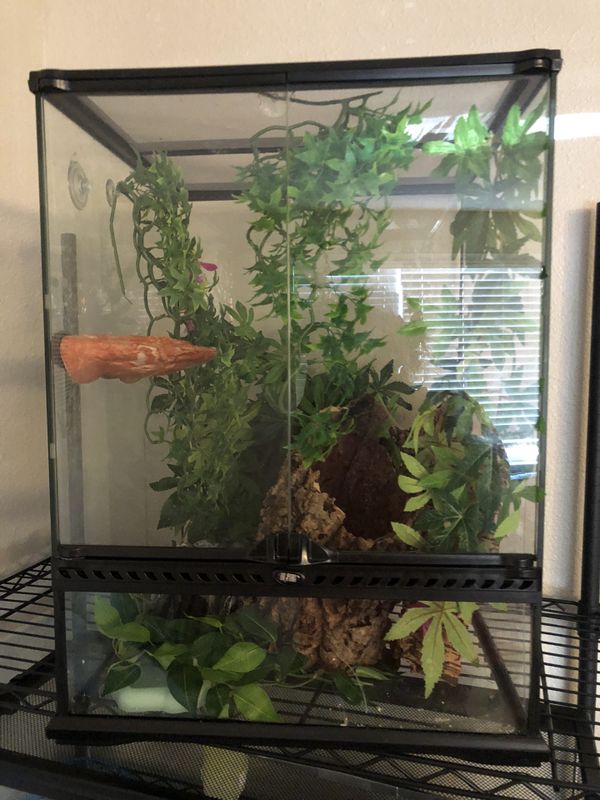
You are a GUI agent. You are given a task and a screenshot of the screen. Output one action in this format:
    pyautogui.click(x=<x>, y=<y>)
    Task: Click on the reflection of miniblinds
    
    Given the screenshot: What is the action you would take?
    pyautogui.click(x=528, y=300)